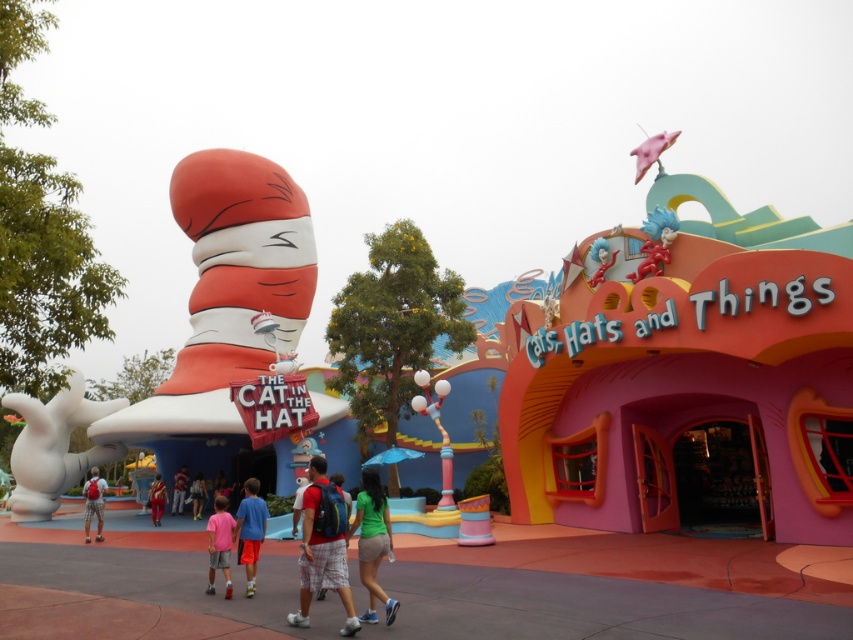
You are a costume designer preparing for a Dr. Seuss themed event. You have two pairs of shorts to choose from for the Cat in the Hat character costume. The green matte shorts at center and the blue fabric shorts at center. Which pair of shorts has a wider width?

The blue fabric shorts at center has a wider width than the green matte shorts at center.

You are a costume designer preparing for a Dr. Seuss themed party. You need to decide which shorts to use for the Cat in the Hat character. The matte red shorts at center and the pink fabric shorts at lower center are available. Which pair has a greater width?

The matte red shorts at center has a greater width than the pink fabric shorts at lower center.

You are a visitor at the Cat in the Hat theme park and you see the green matte shorts at center and orange fabric pants at center. Which clothing item is bigger in size?

The green matte shorts at center is larger in size than orange fabric pants at center.